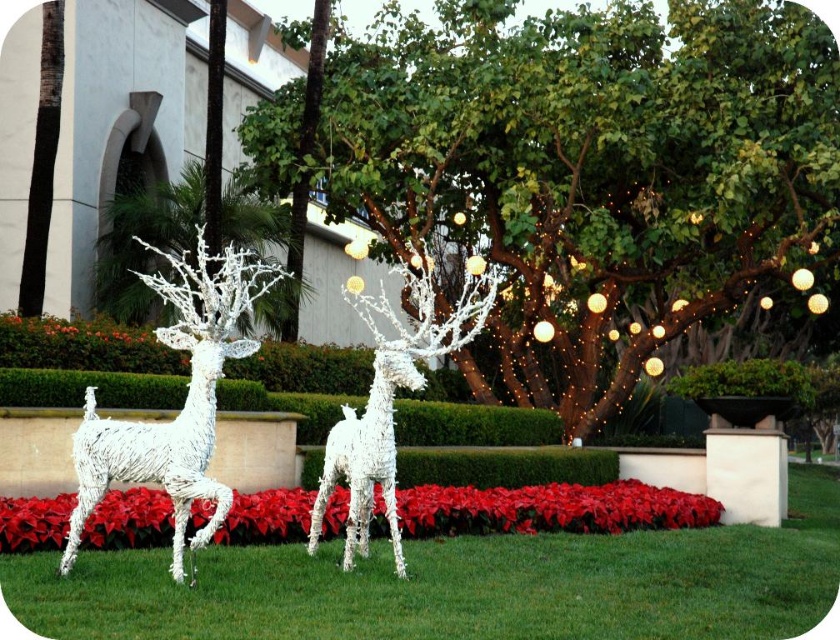
You are a landscape architect designing a garden path between the two white wireframe reindeer sculptures on the lawn and the green leafy tree at center. What is the minimum width the path should be to ensure a walking distance of at least 22.26 meters between the reindeer and the tree?

A: The path should be at least 22.26 meters wide to maintain the required distance between the two white wireframe reindeer sculptures on the lawn and the green leafy tree at center.

You are a gardener planning to water the green leafy tree at center and the green grass at center. Which one should you water first if you want to reach the one higher up first?

The green leafy tree at center is located above the green grass at center, so you should water the green leafy tree at center first.

You are a gardener planning to mow the green grass at center. However, you notice the white wireframe deer at center in the way. Can you mow the grass without moving the deer?

The green grass at center is positioned under the white wireframe deer at center, so the deer is blocking access to the grass. You will need to move the deer to mow the grass properly.